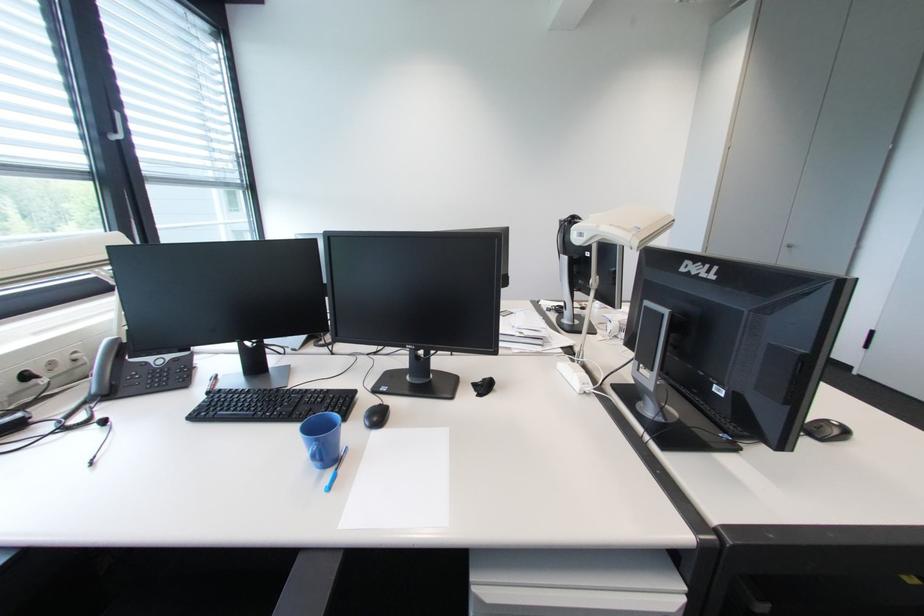
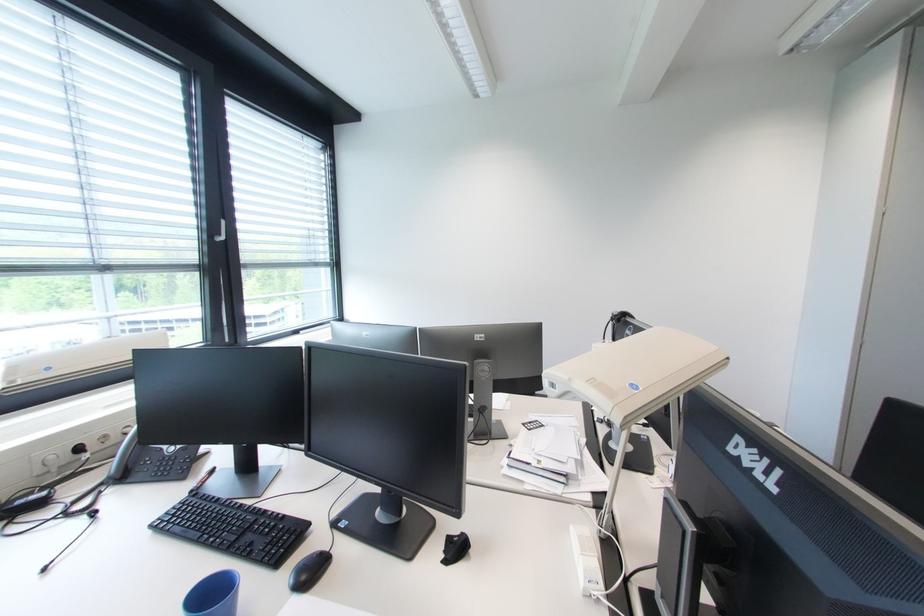
Find the pixel in the second image that matches (110,136) in the first image.

(217, 238)